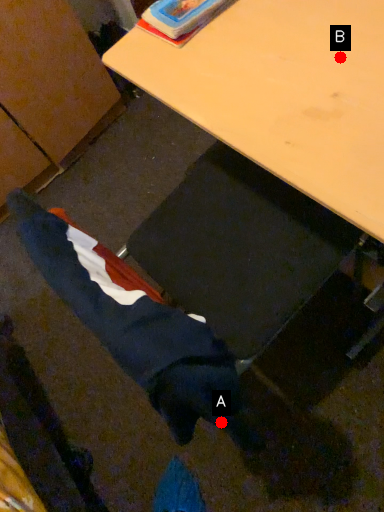
Question: Two points are circled on the image, labeled by A and B beside each circle. Among these points, which one is farthest from the camera?

Choices:
 (A) A is further
 (B) B is further

Answer: (A)